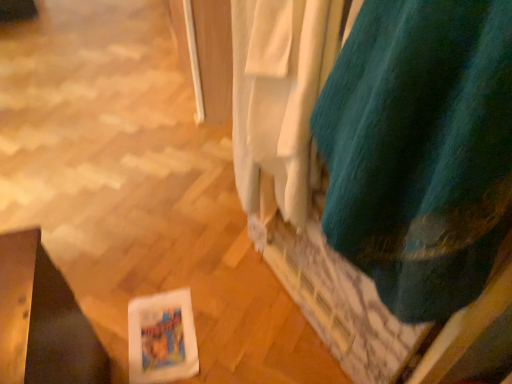
Question: Is teal fabric curtain at upper right, which is the 2th curtain in right-to-left order, situated inside teal felt curtain at right, the second curtain positioned from the left, or outside?

Choices:
 (A) outside
 (B) inside

Answer: (A)

Question: Considering the positions of teal fabric curtain at upper right, which is the 1th curtain in left-to-right order, and teal felt curtain at right, arranged as the first curtain when viewed from the right, in the image, is teal fabric curtain at upper right, which is the 1th curtain in left-to-right order, wider or thinner than teal felt curtain at right, arranged as the first curtain when viewed from the right,?

Choices:
 (A) wide
 (B) thin

Answer: (B)

Question: Considering the positions of point (303, 157) and point (372, 112), is point (303, 157) closer or farther from the camera than point (372, 112)?

Choices:
 (A) farther
 (B) closer

Answer: (A)

Question: Is point (439, 296) positioned closer to the camera than point (282, 82)?

Choices:
 (A) farther
 (B) closer

Answer: (B)

Question: From the image's perspective, is teal felt curtain at right, arranged as the first curtain when viewed from the right, located above or below teal fabric curtain at upper right, which is the 1th curtain in left-to-right order?

Choices:
 (A) below
 (B) above

Answer: (A)

Question: Do you think teal felt curtain at right, the second curtain positioned from the left, is within teal fabric curtain at upper right, which is the 2th curtain in right-to-left order, or outside of it?

Choices:
 (A) outside
 (B) inside

Answer: (A)

Question: From a real-world perspective, is teal felt curtain at right, arranged as the first curtain when viewed from the right, above or below teal fabric curtain at upper right, which is the 2th curtain in right-to-left order?

Choices:
 (A) above
 (B) below

Answer: (A)